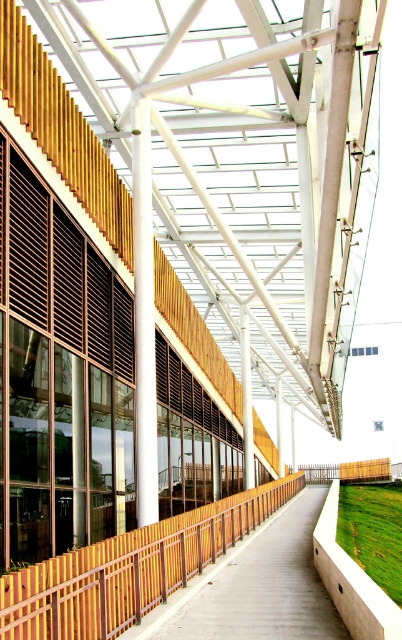
Is point (114, 547) closer to camera compared to point (145, 314)?

Yes.

Does yellow corrugated metal fence at center appear on the left side of white smooth column at center?

No, yellow corrugated metal fence at center is not to the left of white smooth column at center.

You are a GUI agent. You are given a task and a screenshot of the screen. Output one action in this format:
    pyautogui.click(x=<x>, y=<y>)
    Task: Click on the yellow corrugated metal fence at center
    Image resolution: width=402 pixels, height=640 pixels.
    Given the screenshot: What is the action you would take?
    pyautogui.click(x=129, y=570)

In the scene shown: Between yellow corrugated metal fence at center and smooth concrete pavement at center, which one is positioned lower?

smooth concrete pavement at center is lower down.

Between point (24, 589) and point (213, 573), which one is positioned behind?

Positioned behind is point (213, 573).

Find the location of a particular element. yellow corrugated metal fence at center is located at coordinates (129, 570).

The height and width of the screenshot is (640, 402). In order to click on yellow corrugated metal fence at center in this screenshot , I will do 129,570.

Between smooth concrete pavement at center and white matte pillar at center, which one is positioned lower?

smooth concrete pavement at center is below.

Is smooth concrete pavement at center further to camera compared to white matte pillar at center?

No, smooth concrete pavement at center is in front of white matte pillar at center.

This screenshot has height=640, width=402. Identify the location of smooth concrete pavement at center. (254, 586).